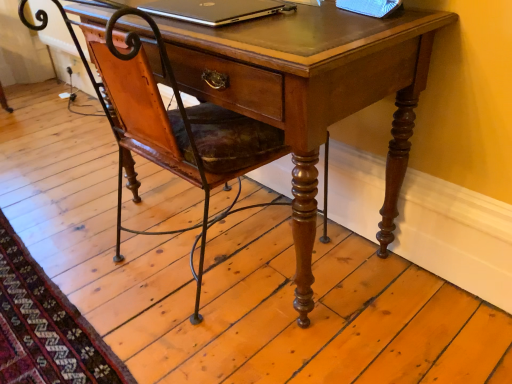
Question: Is silver metallic laptop at upper center taller or shorter than wooden desk at center?

Choices:
 (A) short
 (B) tall

Answer: (A)

Question: Relative to wooden desk at center, is silver metallic laptop at upper center in front or behind?

Choices:
 (A) front
 (B) behind

Answer: (B)

Question: From a real-world perspective, is silver metallic laptop at upper center positioned above or below wooden desk at center?

Choices:
 (A) below
 (B) above

Answer: (B)

Question: Considering the positions of point (403, 142) and point (220, 14), is point (403, 142) closer or farther from the camera than point (220, 14)?

Choices:
 (A) farther
 (B) closer

Answer: (A)

Question: Is wooden desk at center in front of or behind silver metallic laptop at upper center in the image?

Choices:
 (A) behind
 (B) front

Answer: (B)

Question: Considering the positions of wooden desk at center and silver metallic laptop at upper center in the image, is wooden desk at center bigger or smaller than silver metallic laptop at upper center?

Choices:
 (A) big
 (B) small

Answer: (A)

Question: From the image's perspective, is wooden desk at center positioned above or below silver metallic laptop at upper center?

Choices:
 (A) below
 (B) above

Answer: (A)